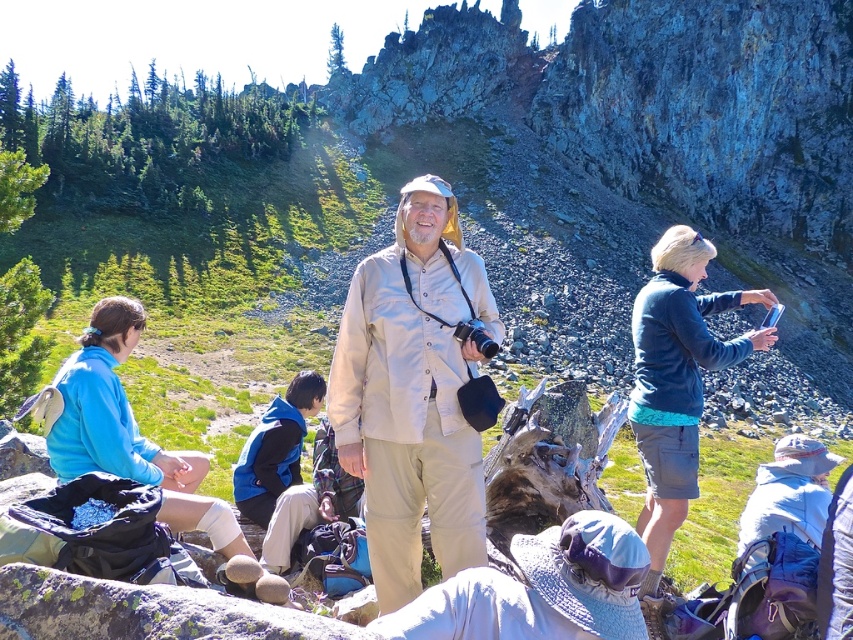
Question: Which object appears farthest from the camera in this image?

Choices:
 (A) beige fabric shirt at center
 (B) dark blue fleece at right

Answer: (A)

Question: Does dark blue fleece at right appear under blue fleece jacket at lower left?

Choices:
 (A) no
 (B) yes

Answer: (A)

Question: Does beige fabric shirt at center appear under dark blue fleece at right?

Choices:
 (A) no
 (B) yes

Answer: (A)

Question: Which point is farther to the camera?

Choices:
 (A) (432, 314)
 (B) (724, 291)

Answer: (B)

Question: Which point is farther to the camera?

Choices:
 (A) blue fleece jacket at lower left
 (B) dark blue fleece at right

Answer: (A)

Question: From the image, what is the correct spatial relationship of beige fabric shirt at center in relation to dark blue fleece at right?

Choices:
 (A) right
 (B) left

Answer: (B)